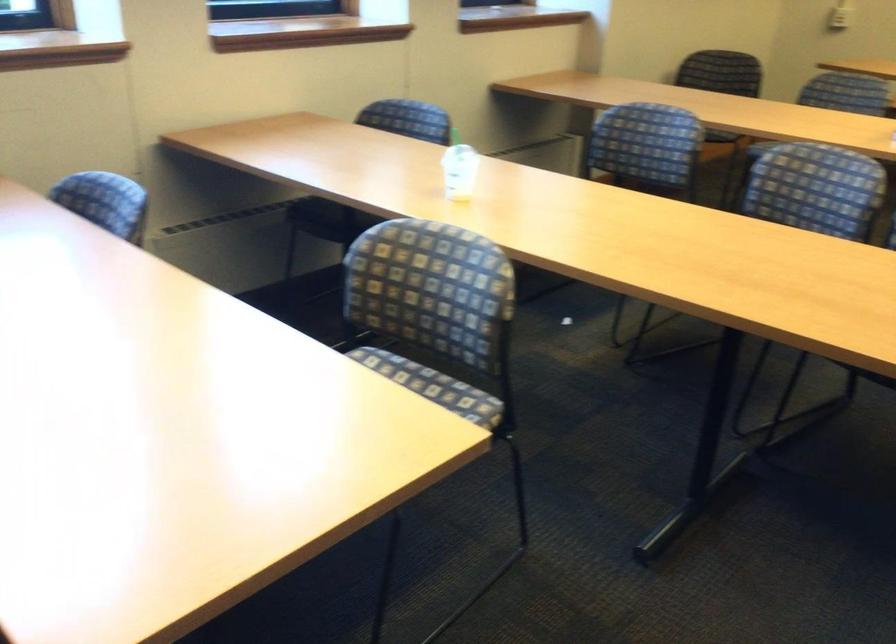
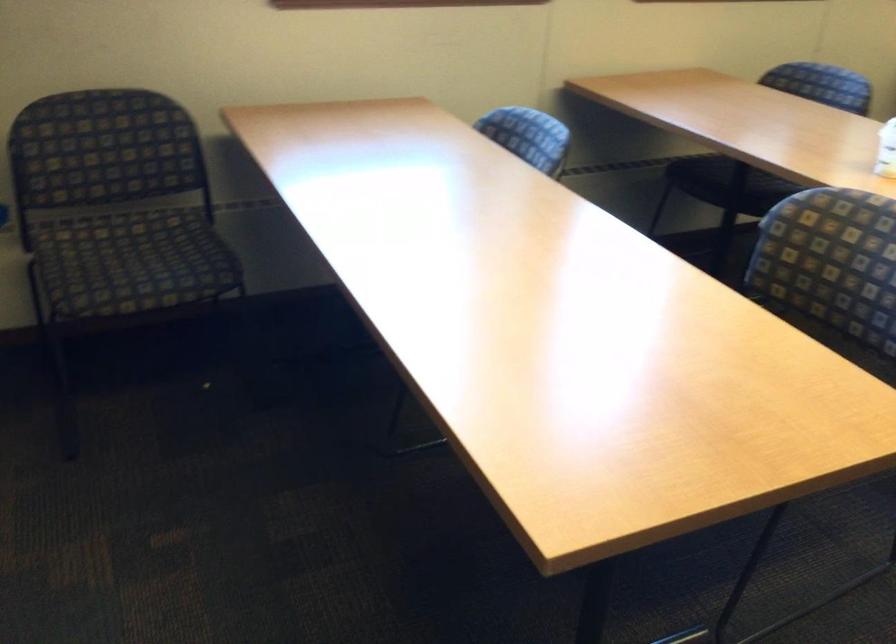
The point at [449,178] is marked in the first image. Where is the corresponding point in the second image?

(885, 149)